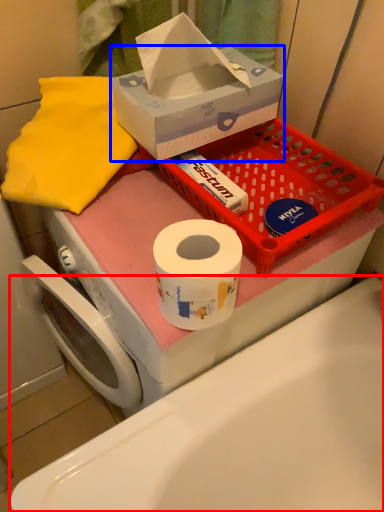
Question: Which object appears closest to the camera in this image, bath (highlighted by a red box) or box (highlighted by a blue box)?

Choices:
 (A) bath
 (B) box

Answer: (A)